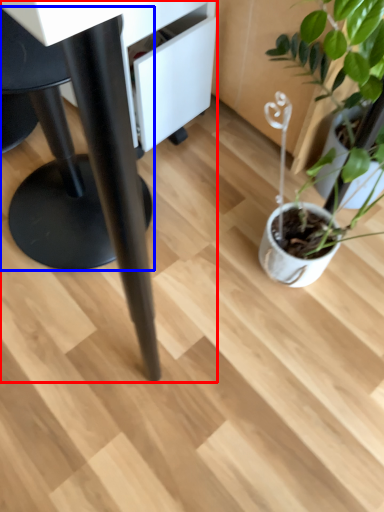
Question: Among these objects, which one is farthest to the camera, table (highlighted by a red box) or swivel chair (highlighted by a blue box)?

Choices:
 (A) table
 (B) swivel chair

Answer: (B)